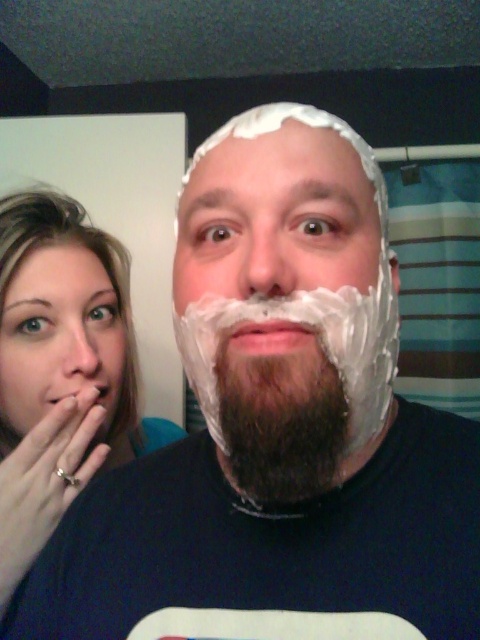
Question: Estimate the real-world distances between objects in this image. Which object is farther from the dark brown beard at center?

Choices:
 (A) matte skin at left
 (B) white foam at center
 (C) blonde hair at left
 (D) white creamy shaving cream at center

Answer: (C)

Question: Which of the following is the closest to the observer?

Choices:
 (A) (272, 456)
 (B) (266, 266)
 (C) (11, 371)
 (D) (63, 376)

Answer: (B)

Question: Can you confirm if white creamy foam at center is wider than white foam at center?

Choices:
 (A) no
 (B) yes

Answer: (A)

Question: Estimate the real-world distances between objects in this image. Which object is closer to the white creamy foam at center?

Choices:
 (A) blonde hair at left
 (B) dark brown beard at center
 (C) white foam at center
 (D) white creamy shaving cream at center

Answer: (C)

Question: In this image, where is matte skin at left located relative to white foam at center?

Choices:
 (A) right
 (B) left

Answer: (B)

Question: Is blonde hair at left below matte skin nose at left?

Choices:
 (A) no
 (B) yes

Answer: (B)